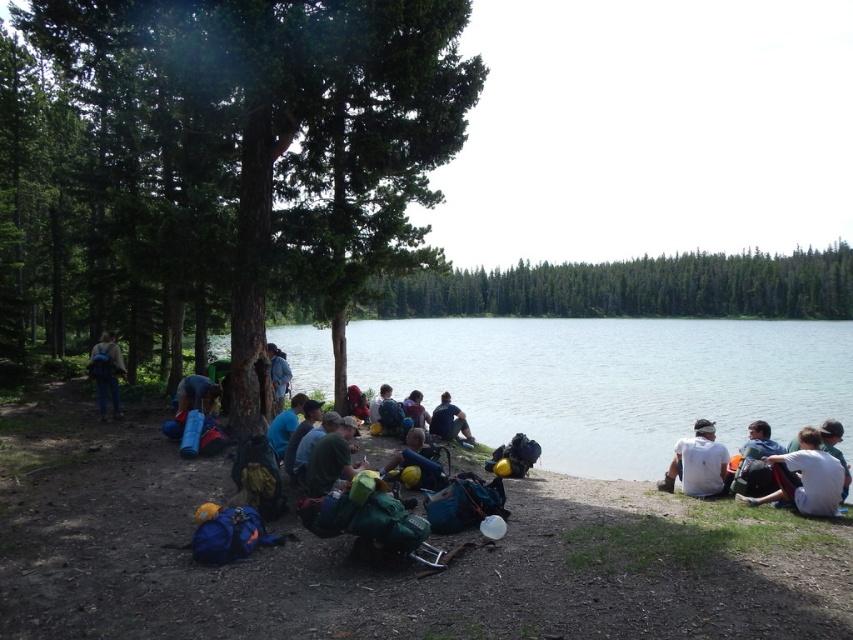
You are a photographer standing at the edge of the lake. You want to take a photo of the green textured pine tree at center and the white cotton shirt at lower right. Which object should you adjust your camera angle to include first if they are not both in frame?

The green textured pine tree at center is positioned over the white cotton shirt at lower right, so you should adjust your camera angle to include the white cotton shirt at lower right first as it is behind the pine tree.

You are a hiker who wants to store your items in order of height. You have a green fabric backpack at center and a yellow fabric mat at center. Which item should you place first if you want to stack them from tallest to shortest?

The green fabric backpack at center is taller than the yellow fabric mat at center, so you should place the green fabric backpack at center first when stacking from tallest to shortest.